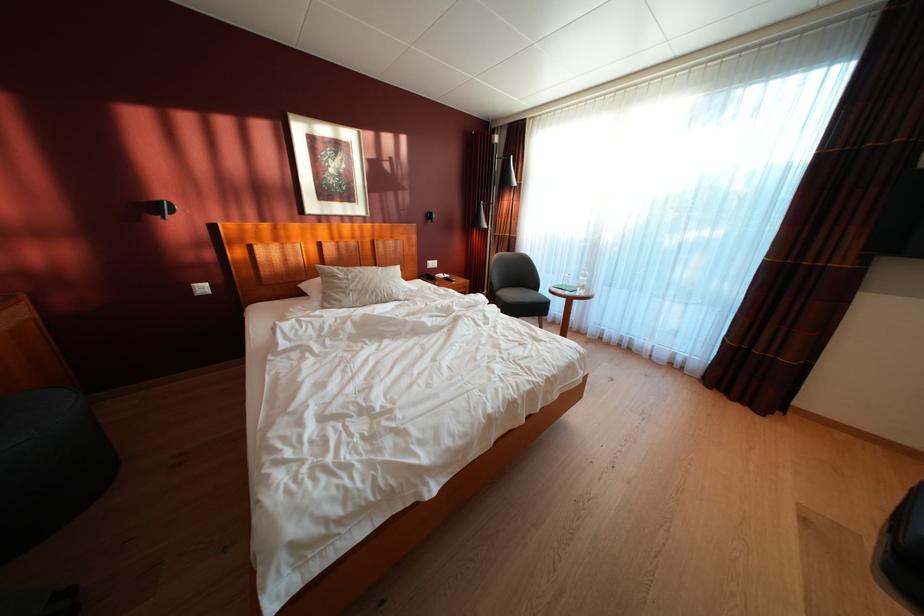
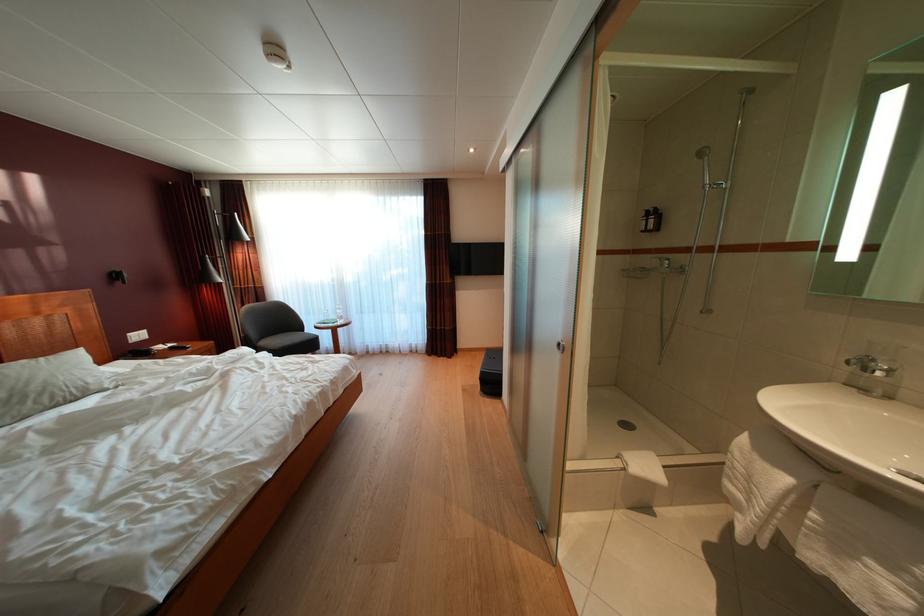
The point at (548, 297) is marked in the first image. Where is the corresponding point in the second image?

(314, 337)